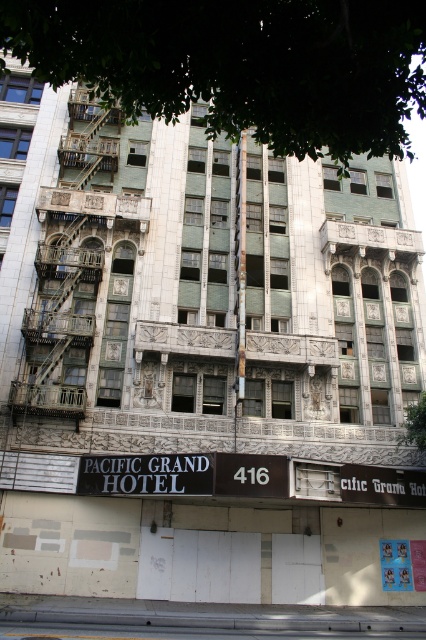
You are standing in front of the Pacific Grand Hotel, and you notice a specific point marked at coordinates (199,493) on the building. If the hotel is 120 feet tall, can you estimate whether this point is located above or below the midpoint of the building?

The point at coordinates (199,493) is 110.98 feet away from the viewer. Since the hotel is 120 feet tall, the midpoint would be at 60 feet. The point is 110.98 feet away, which is beyond the midpoint, so it is located above the midpoint of the building.

You are standing in front of the Pacific Grand Hotel and want to take a photo of the point at coordinates (287, 48) on the building facade. If your camera has a maximum focus range of 15 meters, will it be able to focus on that point?

The distance of point (287, 48) from the camera is 15.28 meters, which exceeds the camera maximum focus range of 15 meters. Therefore, the camera cannot focus on that point.